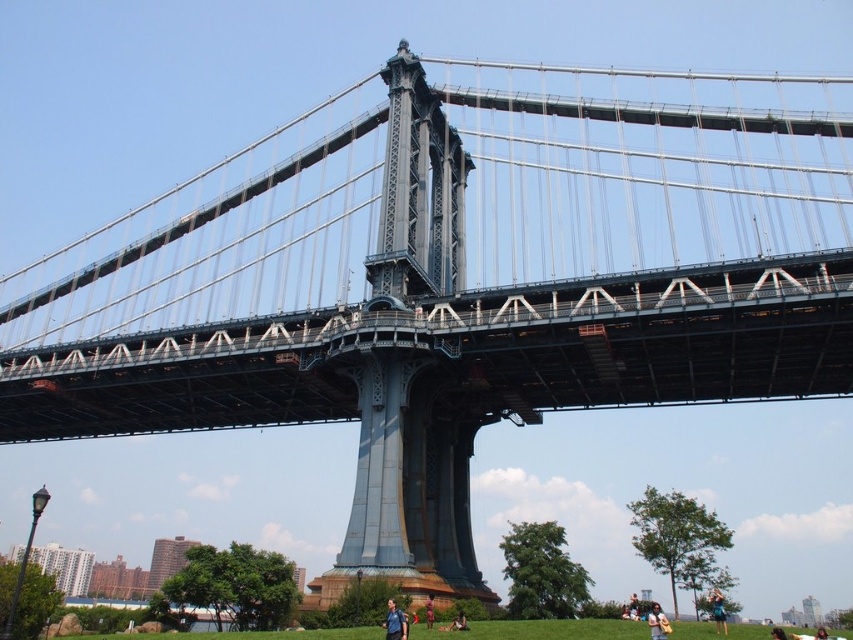
Is point (664, 627) positioned behind point (450, 625)?

That is False.

Is point (654, 628) more distant than point (463, 624)?

That is False.

The width and height of the screenshot is (853, 640). Find the location of `light brown fabric bag at lower center`. light brown fabric bag at lower center is located at coordinates (657, 621).

Which is more to the left, blue denim jeans at lower center or brown skin at lower center?

From the viewer's perspective, brown skin at lower center appears more on the left side.

How much distance is there between blue denim jeans at lower center and brown skin at lower center?

6.76 feet

The image size is (853, 640). In order to click on blue denim jeans at lower center in this screenshot , I will do `click(456, 624)`.

Locate an element on the screen. The width and height of the screenshot is (853, 640). blue denim jeans at lower center is located at coordinates (456, 624).

Does point (386, 627) come behind point (428, 614)?

No, (386, 627) is in front of (428, 614).

Is blue fabric backpack at lower center further to the viewer compared to brown skin at lower center?

No, blue fabric backpack at lower center is in front of brown skin at lower center.

Where is `blue fabric backpack at lower center`? The height and width of the screenshot is (640, 853). blue fabric backpack at lower center is located at coordinates (395, 621).

Image resolution: width=853 pixels, height=640 pixels. What are the coordinates of `blue fabric backpack at lower center` in the screenshot? It's located at (395, 621).